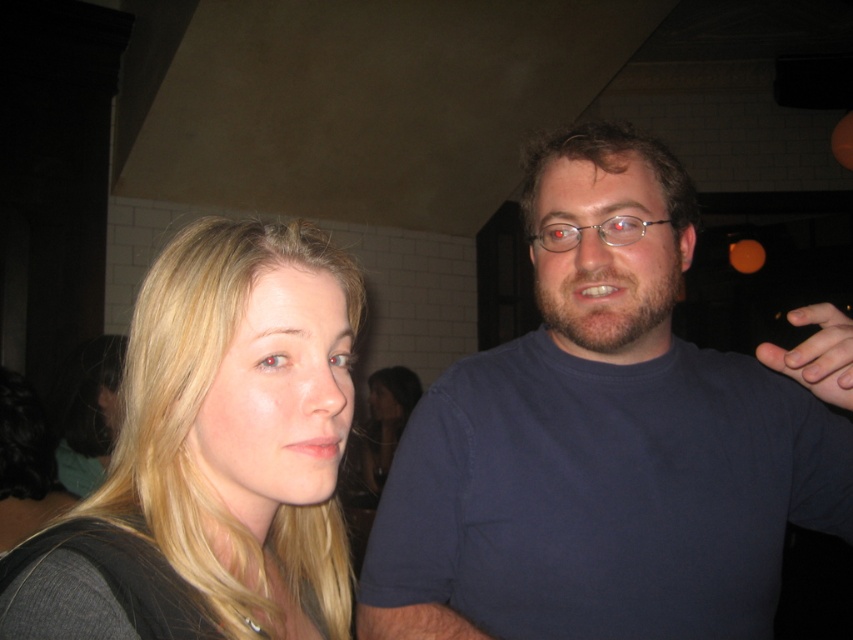
You are standing in the social setting shown in the image and want to move from point A to point B. Point A is at coordinate point (466,460) and point B is at coordinate point (773,352). Which point is closer to you, the observer?

Point A at point (466,460) is closer to you than point B at point (773,352) because it is further to the viewer according to the description.

You are a photographer trying to capture a candid shot of the two people in the scene. You want to ensure that the blue cotton shirt at right and the blonde hair at left are both clearly visible in your photo. Based on their positions, which object should you focus on first to ensure both are in frame?

The blue cotton shirt at right is located above the blonde hair at left. To ensure both are in frame, focus on the blue cotton shirt at right first as it is higher up, allowing the lower positioned blonde hair at left to naturally fall into the shot.

You are taking a photo of the two people in the scene. You want to focus on the person closer to the camera. Which point, point (218, 304) or point (827, 305), should you aim your camera at to ensure the person is in focus?

Point (218, 304) is closer to the camera than point (827, 305), so you should aim your camera at point (218, 304) to ensure the person is in focus.